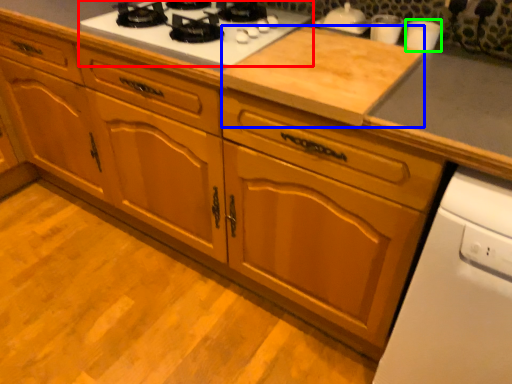
Question: Estimate the real-world distances between objects in this image. Which object is farther from gas stove (highlighted by a red box), plywood (highlighted by a blue box) or appliance (highlighted by a green box)?

Choices:
 (A) plywood
 (B) appliance

Answer: (B)